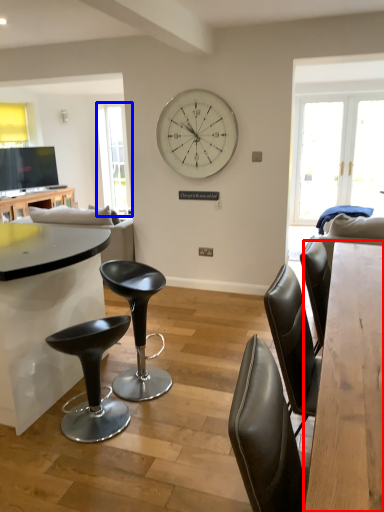
Question: Which of the following is the closest to the observer, table (highlighted by a red box) or window screen (highlighted by a blue box)?

Choices:
 (A) table
 (B) window screen

Answer: (A)